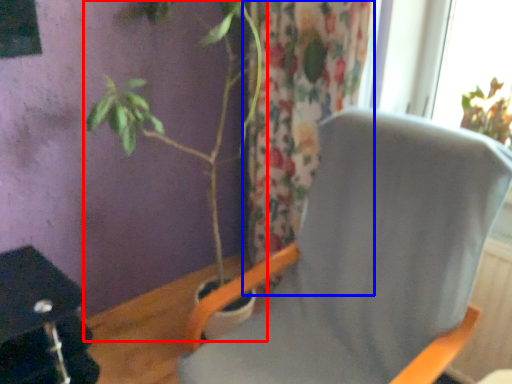
Question: Which object is further to the camera taking this photo, houseplant (highlighted by a red box) or curtain (highlighted by a blue box)?

Choices:
 (A) houseplant
 (B) curtain

Answer: (B)